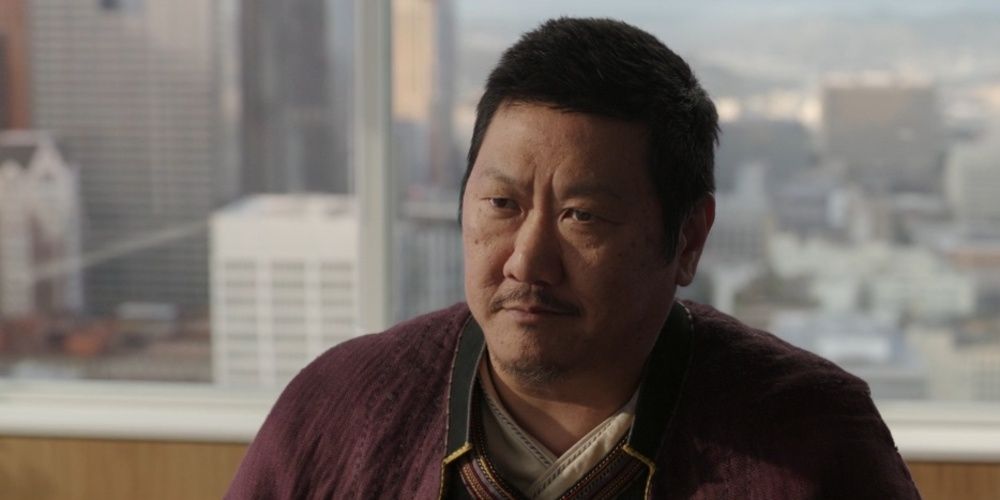
Find the location of a particular element. window is located at coordinates (216, 102), (216, 293), (887, 81), (903, 271).